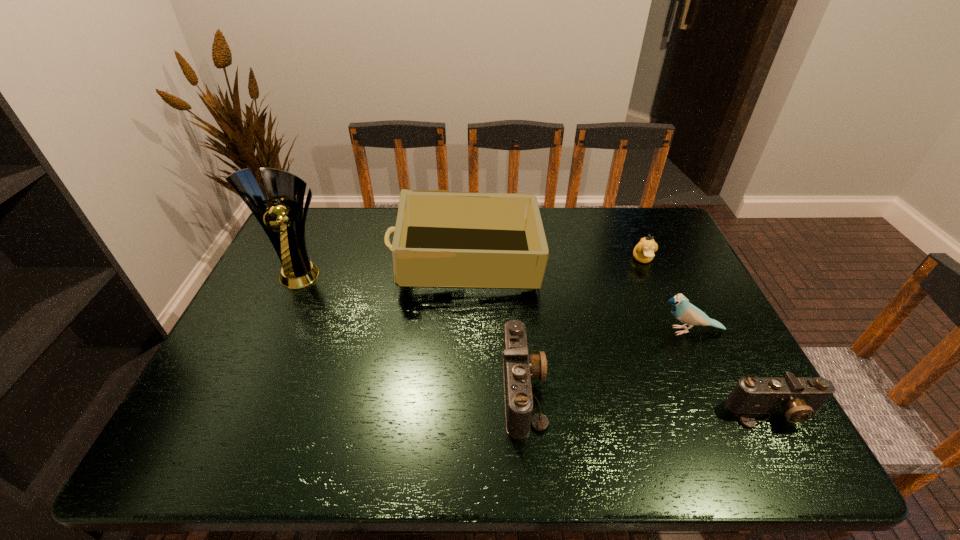
Locate an element on the screen. vacant space that is in between the duckling and the box is located at coordinates (554, 261).

I want to click on empty space between the second tallest object and the bird, so click(577, 296).

In order to click on free spot between the right camera and the tallest object in this screenshot , I will do `click(538, 342)`.

Locate an element on the screen. vacant area that lies between the fourth farthest object and the tallest object is located at coordinates (495, 301).

Where is `empty location between the award and the right camera`? empty location between the award and the right camera is located at coordinates (538, 342).

Locate an element on the screen. free space that is in between the box and the fourth farthest object is located at coordinates (577, 296).

Find the location of a particular element. unoccupied area between the box and the taller camera is located at coordinates (494, 326).

Locate which object is the second closest to the leftmost object. Please provide its 2D coordinates. Your answer should be formatted as a tuple, i.e. [(x, y)], where the tuple contains the x and y coordinates of a point satisfying the conditions above.

[(519, 367)]

Locate an element on the screen. Image resolution: width=960 pixels, height=540 pixels. object that is the third closest to the box is located at coordinates (685, 312).

Locate an element on the screen. Image resolution: width=960 pixels, height=540 pixels. vacant area that satisfies the following two spatial constraints: 1. on the face of the duckling; 2. on the front-facing side of the left camera is located at coordinates (699, 389).